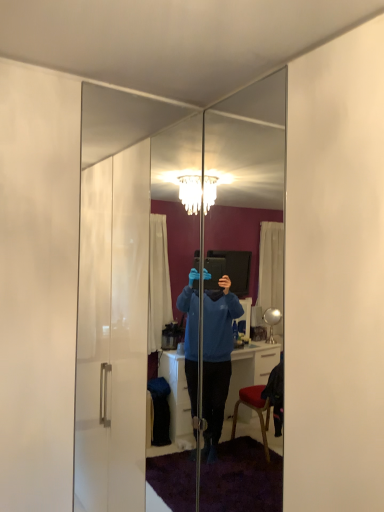
Describe the element at coordinates (122, 275) in the screenshot. The height and width of the screenshot is (512, 384). I see `clear glass mirror at center, the 1th mirror in the left-to-right sequence` at that location.

Locate an element on the screen. This screenshot has height=512, width=384. clear glass mirror at center, the second mirror in the right-to-left sequence is located at coordinates (122, 275).

What do you see at coordinates (249, 145) in the screenshot? The height and width of the screenshot is (512, 384). I see `clear glass mirror at center, the first mirror viewed from the right` at bounding box center [249, 145].

What is the approximate width of clear glass mirror at center, the first mirror viewed from the right?

clear glass mirror at center, the first mirror viewed from the right, is 3.67 centimeters in width.

You are a GUI agent. You are given a task and a screenshot of the screen. Output one action in this format:
    pyautogui.click(x=<x>, y=<y>)
    Task: Click on the clear glass mirror at center, the first mirror viewed from the right
    
    Given the screenshot: What is the action you would take?
    pyautogui.click(x=249, y=145)

Identify the location of clear glass mirror at center, the second mirror in the right-to-left sequence. (122, 275).

Considering the positions of objects clear glass mirror at center, arranged as the second mirror when viewed from the left, and clear glass mirror at center, the 1th mirror in the left-to-right sequence, in the image provided, who is more to the left, clear glass mirror at center, arranged as the second mirror when viewed from the left, or clear glass mirror at center, the 1th mirror in the left-to-right sequence,?

From the viewer's perspective, clear glass mirror at center, the 1th mirror in the left-to-right sequence, appears more on the left side.

Is clear glass mirror at center, the first mirror viewed from the right, in front of or behind clear glass mirror at center, the second mirror in the right-to-left sequence, in the image?

Clearly, clear glass mirror at center, the first mirror viewed from the right, is in front of clear glass mirror at center, the second mirror in the right-to-left sequence.

Considering the points (261, 133) and (130, 130), which point is in front, point (261, 133) or point (130, 130)?

The point (261, 133) is closer.

From the image's perspective, is clear glass mirror at center, arranged as the second mirror when viewed from the left, under clear glass mirror at center, the second mirror in the right-to-left sequence?

Correct, clear glass mirror at center, arranged as the second mirror when viewed from the left, appears lower than clear glass mirror at center, the second mirror in the right-to-left sequence, in the image.

Looking at this image, from a real-world perspective, does clear glass mirror at center, the first mirror viewed from the right, sit lower than clear glass mirror at center, the 1th mirror in the left-to-right sequence?

→ Yes.

Consider the image. In terms of width, does clear glass mirror at center, the first mirror viewed from the right, look wider or thinner when compared to clear glass mirror at center, the second mirror in the right-to-left sequence?

clear glass mirror at center, the first mirror viewed from the right, is wider than clear glass mirror at center, the second mirror in the right-to-left sequence.

Considering the sizes of clear glass mirror at center, arranged as the second mirror when viewed from the left, and clear glass mirror at center, the second mirror in the right-to-left sequence, in the image, is clear glass mirror at center, arranged as the second mirror when viewed from the left, taller or shorter than clear glass mirror at center, the second mirror in the right-to-left sequence,?

Considering their sizes, clear glass mirror at center, arranged as the second mirror when viewed from the left, has less height than clear glass mirror at center, the second mirror in the right-to-left sequence.

Looking at this image, considering the sizes of objects clear glass mirror at center, the first mirror viewed from the right, and clear glass mirror at center, the second mirror in the right-to-left sequence, in the image provided, who is bigger, clear glass mirror at center, the first mirror viewed from the right, or clear glass mirror at center, the second mirror in the right-to-left sequence,?

With larger size is clear glass mirror at center, the first mirror viewed from the right.

Would you say clear glass mirror at center, arranged as the second mirror when viewed from the left, is outside clear glass mirror at center, the second mirror in the right-to-left sequence?

That's correct, clear glass mirror at center, arranged as the second mirror when viewed from the left, is outside of clear glass mirror at center, the second mirror in the right-to-left sequence.

Are clear glass mirror at center, arranged as the second mirror when viewed from the left, and clear glass mirror at center, the second mirror in the right-to-left sequence, far apart?

No, there isn't a large distance between clear glass mirror at center, arranged as the second mirror when viewed from the left, and clear glass mirror at center, the second mirror in the right-to-left sequence.

Looking at this image, is clear glass mirror at center, the 1th mirror in the left-to-right sequence, at the back of clear glass mirror at center, the first mirror viewed from the right?

No.

Can you tell me how much clear glass mirror at center, the first mirror viewed from the right, and clear glass mirror at center, the 1th mirror in the left-to-right sequence, differ in facing direction?

They differ by 90.9 degrees in their facing directions.

Locate an element on the screen. This screenshot has width=384, height=512. mirror above the clear glass mirror at center, the first mirror viewed from the right (from a real-world perspective) is located at coordinates (122, 275).

Which is more to the right, clear glass mirror at center, the second mirror in the right-to-left sequence, or clear glass mirror at center, arranged as the second mirror when viewed from the left?

clear glass mirror at center, arranged as the second mirror when viewed from the left, is more to the right.

Is clear glass mirror at center, the second mirror in the right-to-left sequence, positioned in front of clear glass mirror at center, arranged as the second mirror when viewed from the left?

No, clear glass mirror at center, the second mirror in the right-to-left sequence, is further to the viewer.

Is point (225, 234) closer to viewer compared to point (245, 173)?

That is False.

Looking at this image, from the image's perspective, would you say clear glass mirror at center, the second mirror in the right-to-left sequence, is positioned over clear glass mirror at center, arranged as the second mirror when viewed from the left?

Yes, from the image's perspective, clear glass mirror at center, the second mirror in the right-to-left sequence, is above clear glass mirror at center, arranged as the second mirror when viewed from the left.

From a real-world perspective, is clear glass mirror at center, the second mirror in the right-to-left sequence, on top of clear glass mirror at center, the first mirror viewed from the right?

Yes, from a real-world perspective, clear glass mirror at center, the second mirror in the right-to-left sequence, is above clear glass mirror at center, the first mirror viewed from the right.

Based on the photo, between clear glass mirror at center, the 1th mirror in the left-to-right sequence, and clear glass mirror at center, the first mirror viewed from the right, which one has larger width?

With larger width is clear glass mirror at center, the first mirror viewed from the right.

Is clear glass mirror at center, the 1th mirror in the left-to-right sequence, shorter than clear glass mirror at center, the first mirror viewed from the right?

Incorrect, the height of clear glass mirror at center, the 1th mirror in the left-to-right sequence, does not fall short of that of clear glass mirror at center, the first mirror viewed from the right.

Who is smaller, clear glass mirror at center, the second mirror in the right-to-left sequence, or clear glass mirror at center, the first mirror viewed from the right?

clear glass mirror at center, the second mirror in the right-to-left sequence, is smaller.

Is clear glass mirror at center, the 1th mirror in the left-to-right sequence, outside of clear glass mirror at center, arranged as the second mirror when viewed from the left?

Yes.

Is clear glass mirror at center, the 1th mirror in the left-to-right sequence, not near clear glass mirror at center, the first mirror viewed from the right?

No, clear glass mirror at center, the 1th mirror in the left-to-right sequence, is not far from clear glass mirror at center, the first mirror viewed from the right.

Is clear glass mirror at center, the second mirror in the right-to-left sequence, oriented towards clear glass mirror at center, the first mirror viewed from the right?

Yes, clear glass mirror at center, the second mirror in the right-to-left sequence, is aimed at clear glass mirror at center, the first mirror viewed from the right.

Identify the location of mirror that is on the left side of clear glass mirror at center, the first mirror viewed from the right. [x=122, y=275].

Locate an element on the screen. mirror on the left of clear glass mirror at center, arranged as the second mirror when viewed from the left is located at coordinates (122, 275).

Find the location of `mirror that is above the clear glass mirror at center, the first mirror viewed from the right (from a real-world perspective)`. mirror that is above the clear glass mirror at center, the first mirror viewed from the right (from a real-world perspective) is located at coordinates (122, 275).